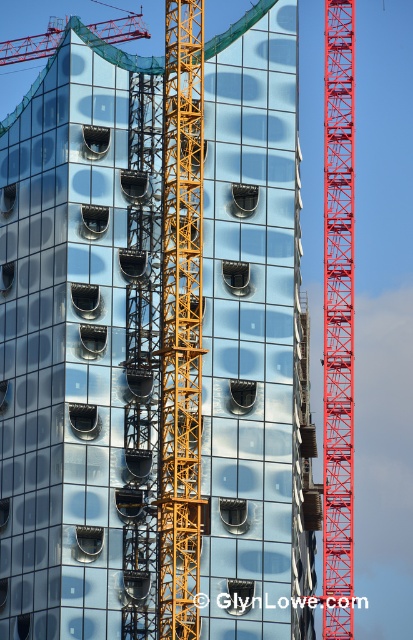
Question: From the image, what is the correct spatial relationship of metallic red crane at right in relation to red metal crane at upper left?

Choices:
 (A) above
 (B) below

Answer: (B)

Question: Which object appears closest to the camera in this image?

Choices:
 (A) red metal crane at upper left
 (B) yellow metallic crane at center

Answer: (B)

Question: Which point appears farthest from the camera in this image?

Choices:
 (A) (142, 33)
 (B) (339, 68)

Answer: (B)

Question: Is the position of yellow metallic crane at center more distant than that of red metal crane at upper left?

Choices:
 (A) no
 (B) yes

Answer: (A)

Question: Does yellow metallic crane at center appear over metallic red crane at right?

Choices:
 (A) no
 (B) yes

Answer: (B)

Question: Which of these objects is positioned closest to the metallic red crane at right?

Choices:
 (A) yellow metallic crane at center
 (B) red metal crane at upper left

Answer: (B)